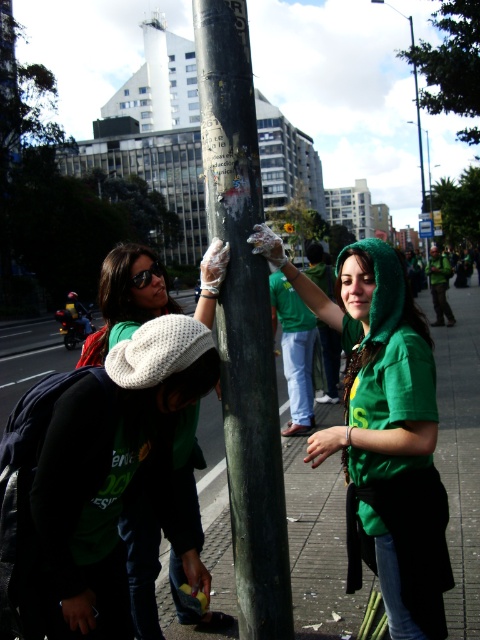
You are a photographer trying to capture a candid shot of the two people in the scene. You notice the green shiny shirt at center and the white knit hat at center. Which one is positioned to the right of the other?

The green shiny shirt at center is positioned on the right side of white knit hat at center, so the green shiny shirt at center is to the right of the white knit hat at center.